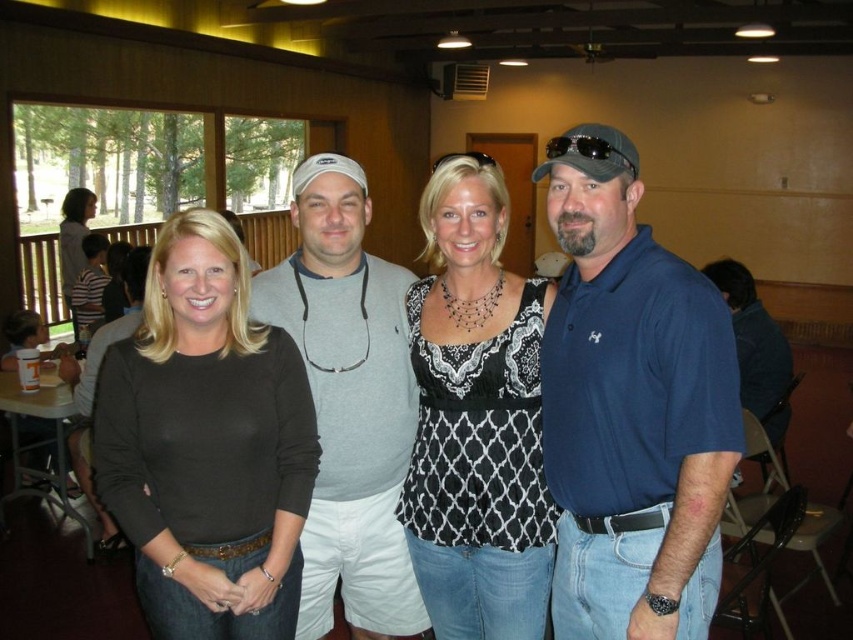
Question: Which point appears farthest from the camera in this image?

Choices:
 (A) (310, 560)
 (B) (229, 428)
 (C) (627, 412)

Answer: (A)

Question: Can you confirm if blue cotton polo shirt at right is smaller than black lace top at center?

Choices:
 (A) yes
 (B) no

Answer: (A)

Question: Which point is closer to the camera?

Choices:
 (A) gray cotton sweater at center
 (B) blue cotton polo shirt at right

Answer: (B)

Question: Among these points, which one is nearest to the camera?

Choices:
 (A) (70, 188)
 (B) (396, 452)
 (C) (665, 477)
 (D) (506, 305)

Answer: (C)

Question: Is blue cotton polo shirt at right bigger than black lace top at center?

Choices:
 (A) yes
 (B) no

Answer: (B)

Question: Is blue cotton polo shirt at right in front of black lace top at center?

Choices:
 (A) no
 (B) yes

Answer: (B)